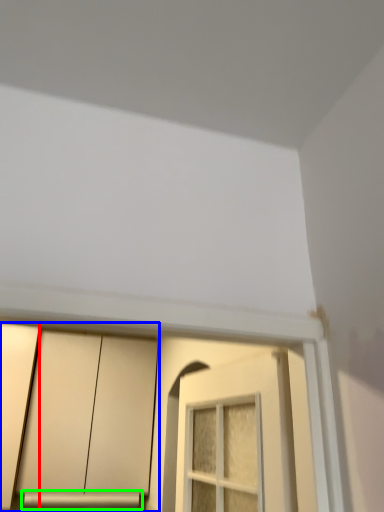
Question: Estimate the real-world distances between objects in this image. Which object is farther from door (highlighted by a red box), cabinetry (highlighted by a blue box) or window sill (highlighted by a green box)?

Choices:
 (A) cabinetry
 (B) window sill

Answer: (B)